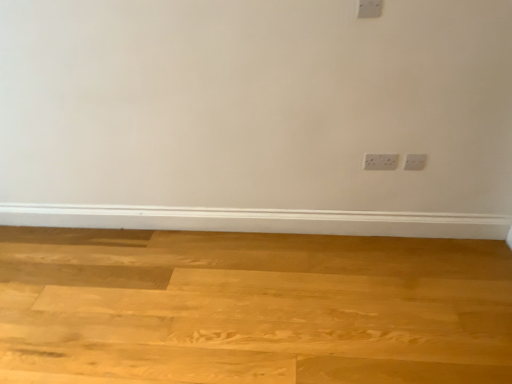
In order to face white plastic power plugs and sockets at right, should I rotate leftwards or rightwards?

Rotate right and turn 20.919 degrees.

Identify the location of white plastic power plugs and sockets at right. This screenshot has height=384, width=512. (415, 162).

From the picture: Measure the distance between white plastic power plugs and sockets at right and camera.

white plastic power plugs and sockets at right and camera are 1.96 meters apart from each other.

What do you see at coordinates (415, 162) in the screenshot? The width and height of the screenshot is (512, 384). I see `white plastic power plugs and sockets at right` at bounding box center [415, 162].

The image size is (512, 384). Describe the element at coordinates (251, 308) in the screenshot. I see `natural wood plywood at lower center` at that location.

The width and height of the screenshot is (512, 384). I want to click on natural wood plywood at lower center, so pos(251,308).

In order to face natural wood plywood at lower center, should I rotate leftwards or rightwards?

You should rotate left by 3.631 degrees.

The image size is (512, 384). Find the location of `white plastic power plugs and sockets at right`. white plastic power plugs and sockets at right is located at coordinates (415, 162).

Is natural wood plywood at lower center to the left or to the right of white plastic power plugs and sockets at right in the image?

From the image, it's evident that natural wood plywood at lower center is to the left of white plastic power plugs and sockets at right.

In the image, is natural wood plywood at lower center positioned in front of or behind white plastic power plugs and sockets at right?

Clearly, natural wood plywood at lower center is in front of white plastic power plugs and sockets at right.

Between point (230, 346) and point (416, 168), which one is positioned behind?

The point (416, 168) is behind.

From the image's perspective, which is below, natural wood plywood at lower center or white plastic power plugs and sockets at right?

Answer: natural wood plywood at lower center.

From a real-world perspective, is natural wood plywood at lower center positioned over white plastic power plugs and sockets at right based on gravity?

No, from a real-world perspective, natural wood plywood at lower center is not on top of white plastic power plugs and sockets at right.

Is natural wood plywood at lower center thinner than white plastic power plugs and sockets at right?

No, natural wood plywood at lower center is not thinner than white plastic power plugs and sockets at right.

Who is shorter, natural wood plywood at lower center or white plastic power plugs and sockets at right?

natural wood plywood at lower center is shorter.

Considering the relative sizes of natural wood plywood at lower center and white plastic power plugs and sockets at right in the image provided, is natural wood plywood at lower center bigger than white plastic power plugs and sockets at right?

Yes, natural wood plywood at lower center is bigger than white plastic power plugs and sockets at right.

Is natural wood plywood at lower center inside or outside of white plastic power plugs and sockets at right?

natural wood plywood at lower center is located beyond the bounds of white plastic power plugs and sockets at right.

Is natural wood plywood at lower center not close to white plastic power plugs and sockets at right?

Indeed, natural wood plywood at lower center is not near white plastic power plugs and sockets at right.

Is white plastic power plugs and sockets at right at the back of natural wood plywood at lower center?

That's not correct — natural wood plywood at lower center is not looking away from white plastic power plugs and sockets at right.

How different are the orientations of natural wood plywood at lower center and white plastic power plugs and sockets at right in degrees?

They differ by 91.5 degrees in their facing directions.

How much distance is there between natural wood plywood at lower center and white plastic power plugs and sockets at right?

natural wood plywood at lower center and white plastic power plugs and sockets at right are 1.01 meters apart.

This screenshot has height=384, width=512. Identify the location of power plugs and sockets on the right of natural wood plywood at lower center. [415, 162].

Between white plastic power plugs and sockets at right and natural wood plywood at lower center, which one appears on the left side from the viewer's perspective?

From the viewer's perspective, natural wood plywood at lower center appears more on the left side.

In the image, is white plastic power plugs and sockets at right positioned in front of or behind natural wood plywood at lower center?

Visually, white plastic power plugs and sockets at right is located behind natural wood plywood at lower center.

Which is more distant, (417, 154) or (68, 247)?

The point (68, 247) is more distant.

From the image's perspective, relative to natural wood plywood at lower center, is white plastic power plugs and sockets at right above or below?

white plastic power plugs and sockets at right is above natural wood plywood at lower center.

From a real-world perspective, is white plastic power plugs and sockets at right positioned over natural wood plywood at lower center based on gravity?

Yes, from a real-world perspective, white plastic power plugs and sockets at right is on top of natural wood plywood at lower center.

Which object is thinner, white plastic power plugs and sockets at right or natural wood plywood at lower center?

Thinner between the two is white plastic power plugs and sockets at right.

Looking at this image, considering the relative sizes of white plastic power plugs and sockets at right and natural wood plywood at lower center in the image provided, is white plastic power plugs and sockets at right shorter than natural wood plywood at lower center?

No.

Based on the photo, who is smaller, white plastic power plugs and sockets at right or natural wood plywood at lower center?

white plastic power plugs and sockets at right.

Is white plastic power plugs and sockets at right surrounding natural wood plywood at lower center?

Actually, natural wood plywood at lower center is outside white plastic power plugs and sockets at right.

Is there a large distance between white plastic power plugs and sockets at right and natural wood plywood at lower center?

Yes, white plastic power plugs and sockets at right and natural wood plywood at lower center are located far from each other.

Is white plastic power plugs and sockets at right turned away from natural wood plywood at lower center?

white plastic power plugs and sockets at right is not turned away from natural wood plywood at lower center.

Find the location of a particular element. plywood located below the white plastic power plugs and sockets at right (from the image's perspective) is located at coordinates (251, 308).

Identify the location of power plugs and sockets behind the natural wood plywood at lower center. The width and height of the screenshot is (512, 384). (415, 162).

Where is `plywood below the white plastic power plugs and sockets at right (from a real-world perspective)`? plywood below the white plastic power plugs and sockets at right (from a real-world perspective) is located at coordinates (251, 308).